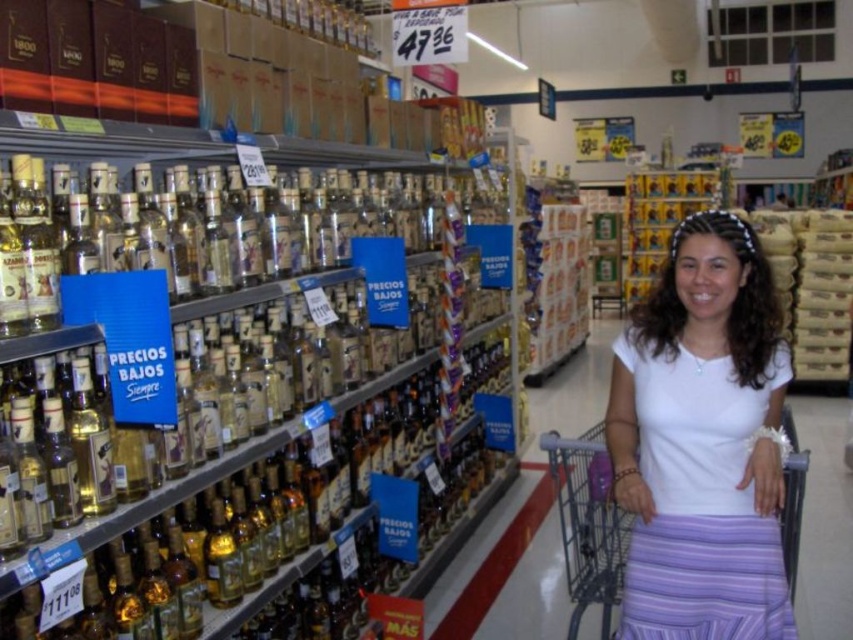
You are a customer in the grocery store looking at the alcohol aisle. You see the point marked at coordinate (701,442). What object is located at that point?

The point at coordinate (701,442) marks the white matte shirt at center.